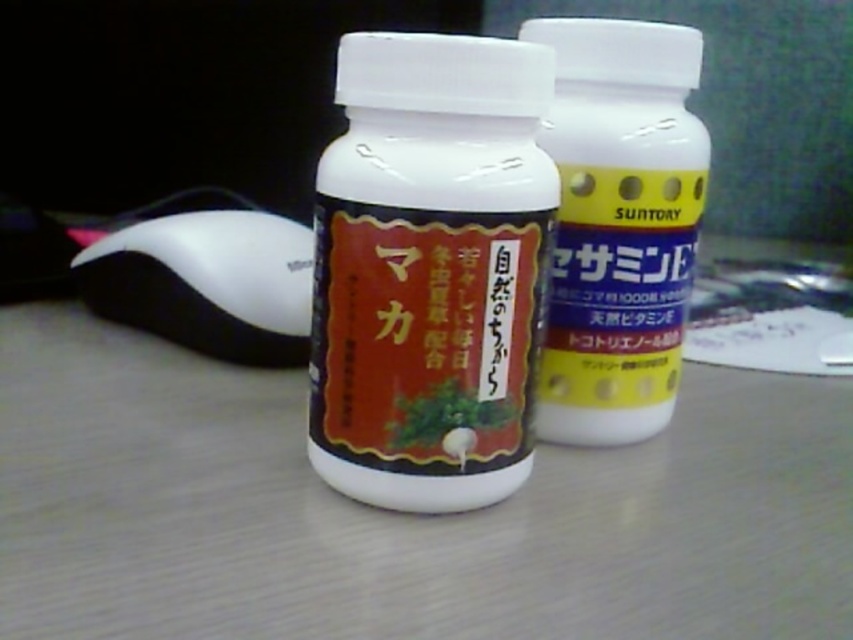
Question: Does white plastic table at center lie behind white plastic mouse at lower left?

Choices:
 (A) yes
 (B) no

Answer: (B)

Question: Which of the following is the closest to the observer?

Choices:
 (A) (448, 452)
 (B) (593, 564)
 (C) (204, 324)
 (D) (546, 138)

Answer: (B)

Question: Can you confirm if white plastic table at center is bigger than white plastic mouse at lower left?

Choices:
 (A) yes
 (B) no

Answer: (A)

Question: Which object is positioned farthest from the white plastic mouse at lower left?

Choices:
 (A) yellow matte bottle at center
 (B) white glossy bottle at center

Answer: (A)

Question: Which of the following is the closest to the observer?

Choices:
 (A) (399, 422)
 (B) (222, 291)
 (C) (294, 595)
 (D) (612, 138)

Answer: (C)

Question: Does white plastic table at center have a greater width compared to yellow matte bottle at center?

Choices:
 (A) no
 (B) yes

Answer: (B)